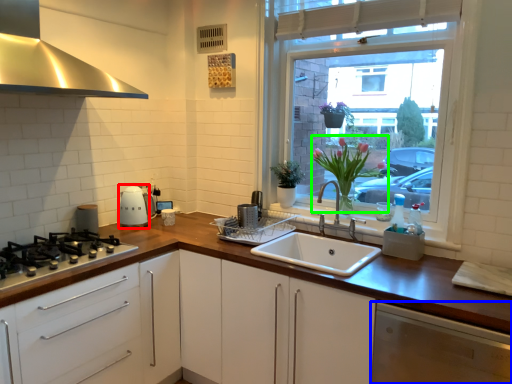
Question: Considering the real-world distances, which object is farthest from appliance (highlighted by a red box)? cabinetry (highlighted by a blue box) or floral arrangement (highlighted by a green box)?

Choices:
 (A) cabinetry
 (B) floral arrangement

Answer: (A)